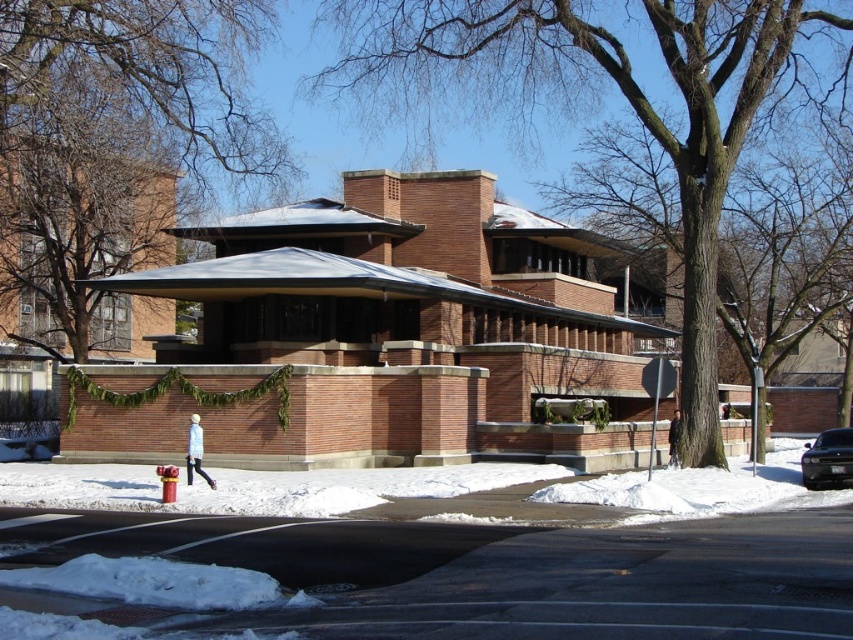
Question: Based on their relative distances, which object is nearer to the brown textured tree at center?

Choices:
 (A) brown brick gazebo at center
 (B) shiny black sedan at lower right

Answer: (A)

Question: Considering the relative positions of bare branches at upper center and shiny black sedan at lower right in the image provided, where is bare branches at upper center located with respect to shiny black sedan at lower right?

Choices:
 (A) right
 (B) left

Answer: (B)

Question: Which object is the farthest from the bare branches at upper center?

Choices:
 (A) shiny black sedan at lower right
 (B) brown textured tree at center

Answer: (A)

Question: Which of the following is the closest to the observer?

Choices:
 (A) (x=730, y=74)
 (B) (x=827, y=460)
 (C) (x=573, y=324)

Answer: (B)

Question: Where is brown textured tree at center located in relation to shiny black sedan at lower right in the image?

Choices:
 (A) left
 (B) right

Answer: (A)

Question: Is bare branches at upper center to the left of shiny black sedan at lower right from the viewer's perspective?

Choices:
 (A) yes
 (B) no

Answer: (A)